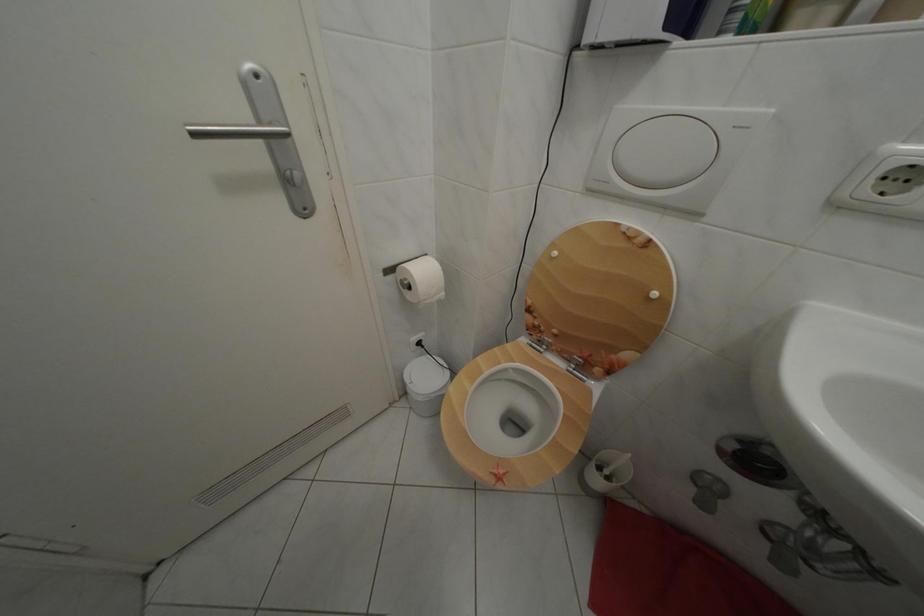
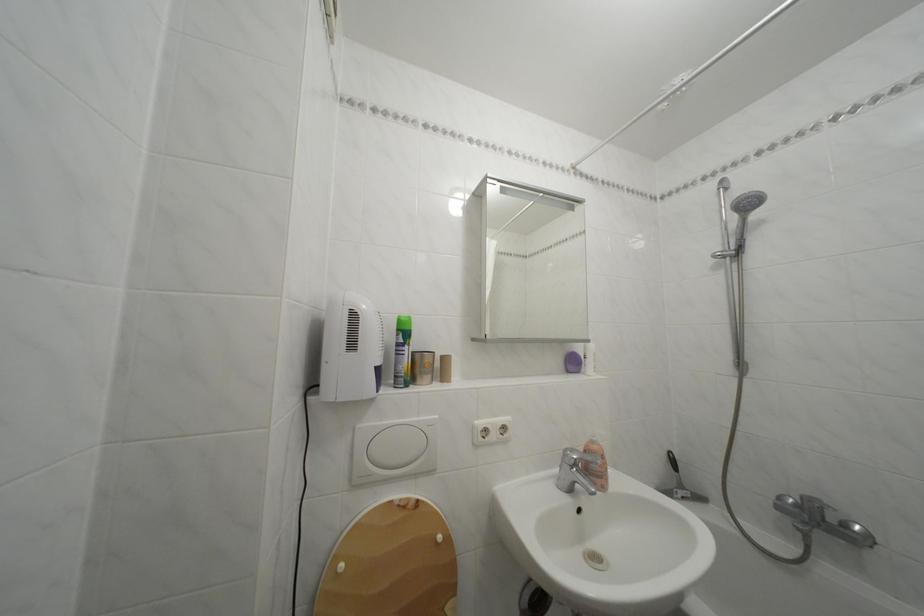
Locate, in the second image, the point that corresponds to point 564,259 in the first image.

(350, 573)